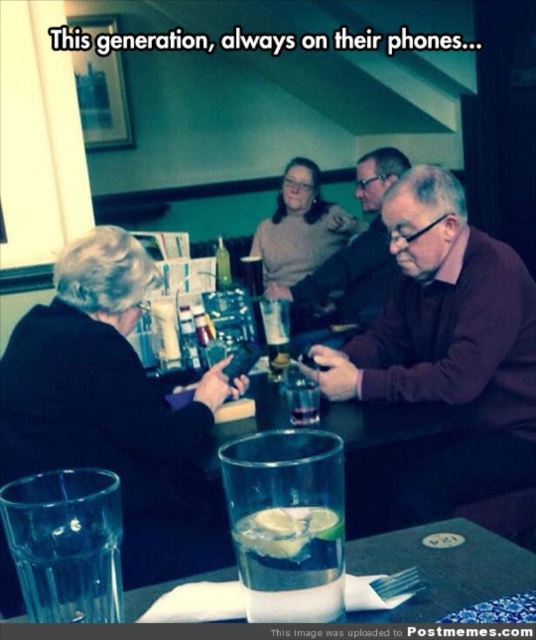
Question: Which object is farther from the camera taking this photo?

Choices:
 (A) clear glass at lower center
 (B) clear glass with lime slices at center

Answer: (A)

Question: Considering the relative positions of clear glass with lime slices at center and clear glass at center in the image provided, where is clear glass with lime slices at center located with respect to clear glass at center?

Choices:
 (A) above
 (B) below

Answer: (B)

Question: Is clear glass at lower center bigger than matte brown sweater at center?

Choices:
 (A) no
 (B) yes

Answer: (A)

Question: Which point is closer to the camera?

Choices:
 (A) pyautogui.click(x=222, y=284)
 (B) pyautogui.click(x=391, y=284)
 (C) pyautogui.click(x=288, y=362)

Answer: (C)

Question: Which of the following is the closest to the observer?

Choices:
 (A) dark brown sweater at center
 (B) clear glass at lower center

Answer: (B)

Question: Considering the relative positions of clear glass at lower center and clear glass with lime slices at center in the image provided, where is clear glass at lower center located with respect to clear glass with lime slices at center?

Choices:
 (A) left
 (B) right

Answer: (A)